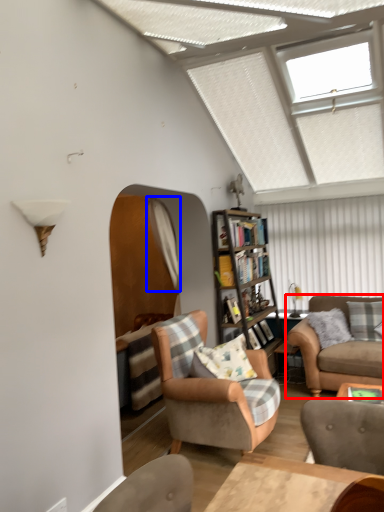
Question: Which object appears closest to the camera in this image, studio couch (highlighted by a red box) or curtain (highlighted by a blue box)?

Choices:
 (A) studio couch
 (B) curtain

Answer: (A)